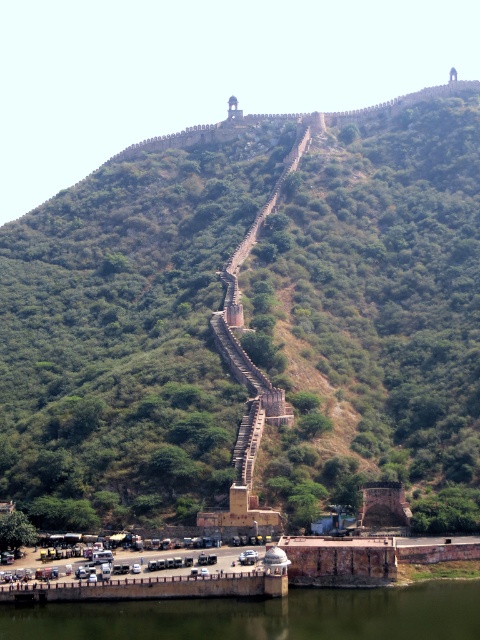
Question: Is green stone staircase at upper center below green concrete river at lower center?

Choices:
 (A) no
 (B) yes

Answer: (A)

Question: Which object is farther from the camera taking this photo?

Choices:
 (A) green concrete river at lower center
 (B) green stone staircase at upper center

Answer: (B)

Question: Which point appears farthest from the camera in this image?

Choices:
 (A) (360, 596)
 (B) (110, 477)

Answer: (B)

Question: Considering the relative positions of green stone staircase at upper center and green concrete river at lower center in the image provided, where is green stone staircase at upper center located with respect to green concrete river at lower center?

Choices:
 (A) left
 (B) right

Answer: (A)

Question: Among these objects, which one is farthest from the camera?

Choices:
 (A) green concrete river at lower center
 (B) green stone staircase at upper center

Answer: (B)

Question: Does green stone staircase at upper center have a smaller size compared to green concrete river at lower center?

Choices:
 (A) yes
 (B) no

Answer: (B)